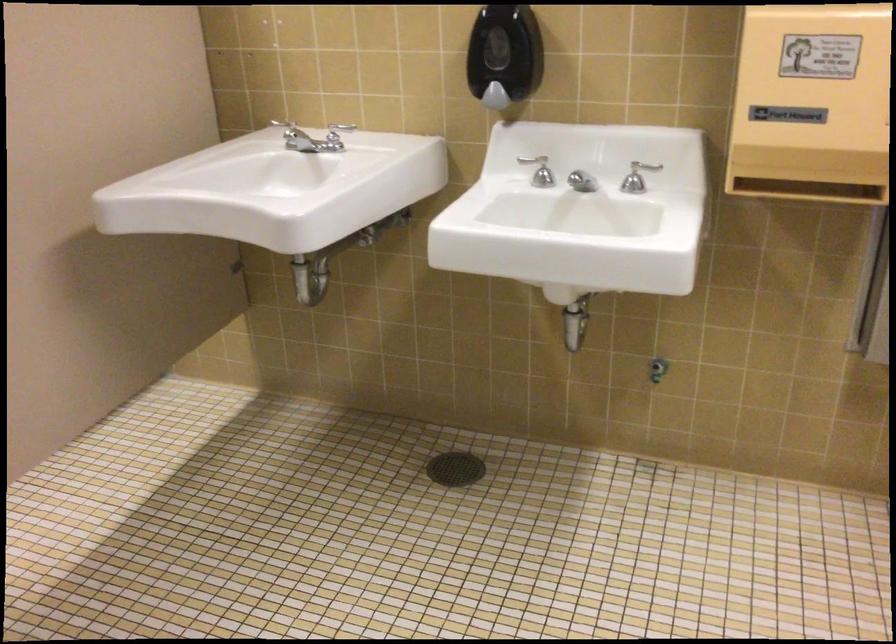
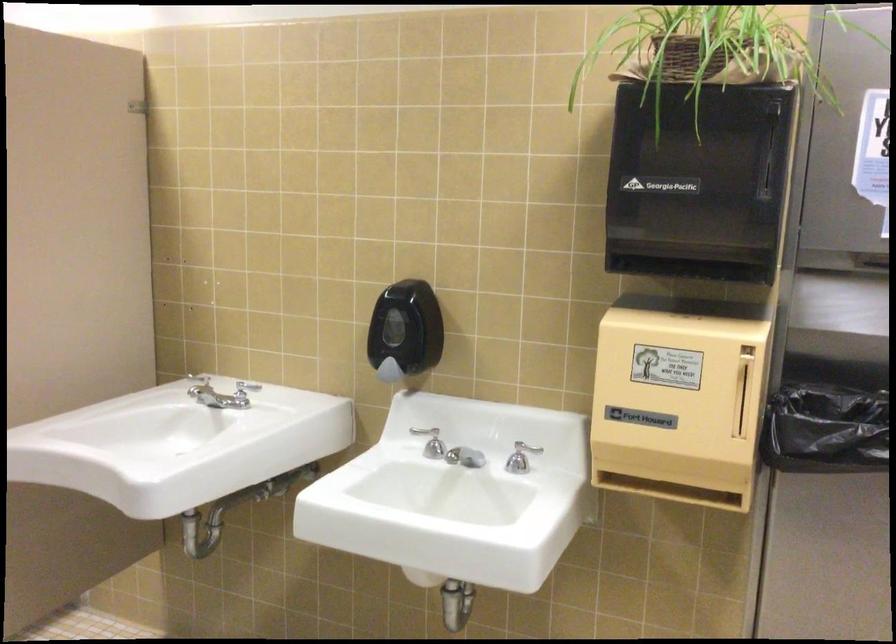
Find the pixel in the second image that matches point (496, 98) in the first image.

(389, 371)